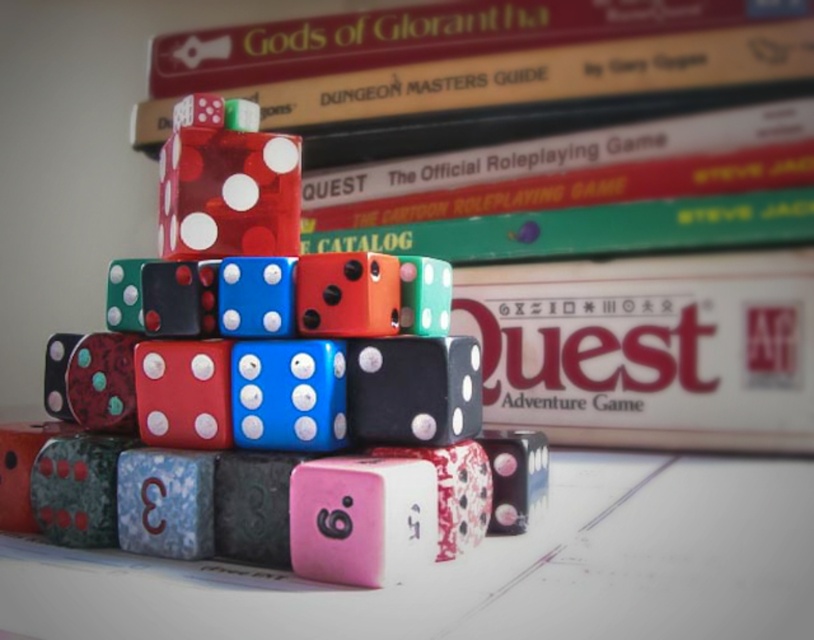
Question: Which object is the farthest from the hardcover book at center?

Choices:
 (A) translucent red dice at center
 (B) shiny plastic dice at center

Answer: (B)

Question: Does shiny plastic dice at center appear on the right side of translucent red dice at center?

Choices:
 (A) no
 (B) yes

Answer: (B)

Question: Which of the following is the closest to the observer?

Choices:
 (A) hardcover book at center
 (B) shiny plastic dice at center
 (C) matte plastic quest adventure game at center

Answer: (B)

Question: Which of the following is the closest to the observer?

Choices:
 (A) matte plastic quest adventure game at center
 (B) shiny plastic dice at center
 (C) translucent red dice at center
 (D) hardcover book at center

Answer: (B)

Question: In this image, where is shiny plastic dice at center located relative to translucent red dice at center?

Choices:
 (A) above
 (B) below

Answer: (B)

Question: Does matte plastic quest adventure game at center have a larger size compared to translucent red dice at center?

Choices:
 (A) yes
 (B) no

Answer: (A)